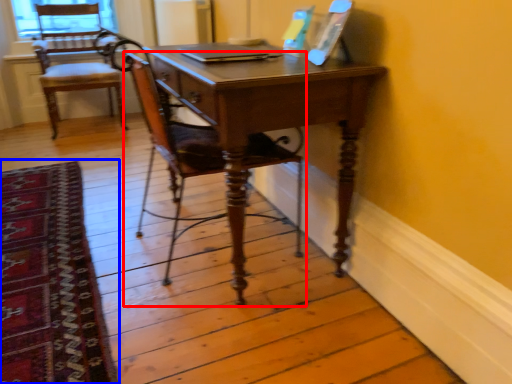
Question: Which point is further to the camera, chair (highlighted by a red box) or mat (highlighted by a blue box)?

Choices:
 (A) chair
 (B) mat

Answer: (A)